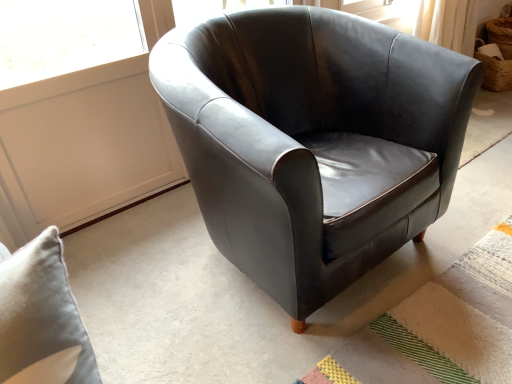
At what (x,y) coordinates should I click in order to perform the action: click on free region under textured woven mat at lower right (from a real-world perspective). Please return your answer as a coordinate pair (x, y). The height and width of the screenshot is (384, 512). Looking at the image, I should click on (443, 317).